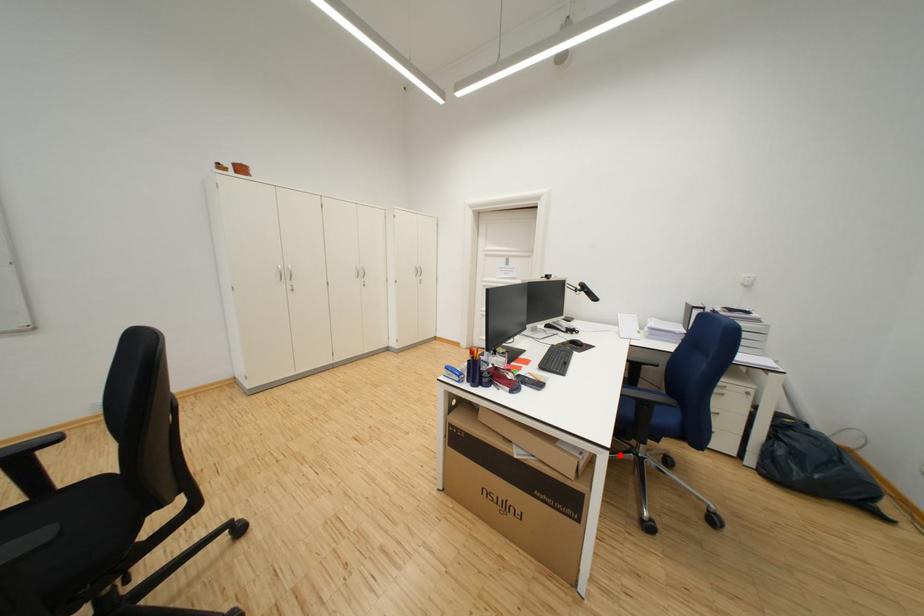
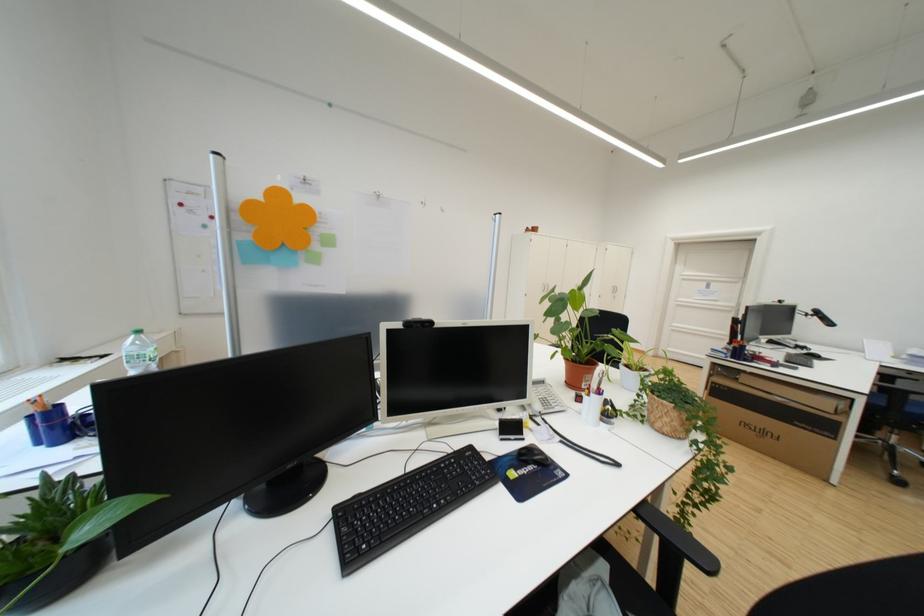
Question: I am providing you with two images of the same scene from different viewpoints. Given a red point in image1, look at the same physical point in image2. Is it:

Choices:
 (A) Closer to the viewpoint
 (B) Farther from the viewpoint

Answer: (A)